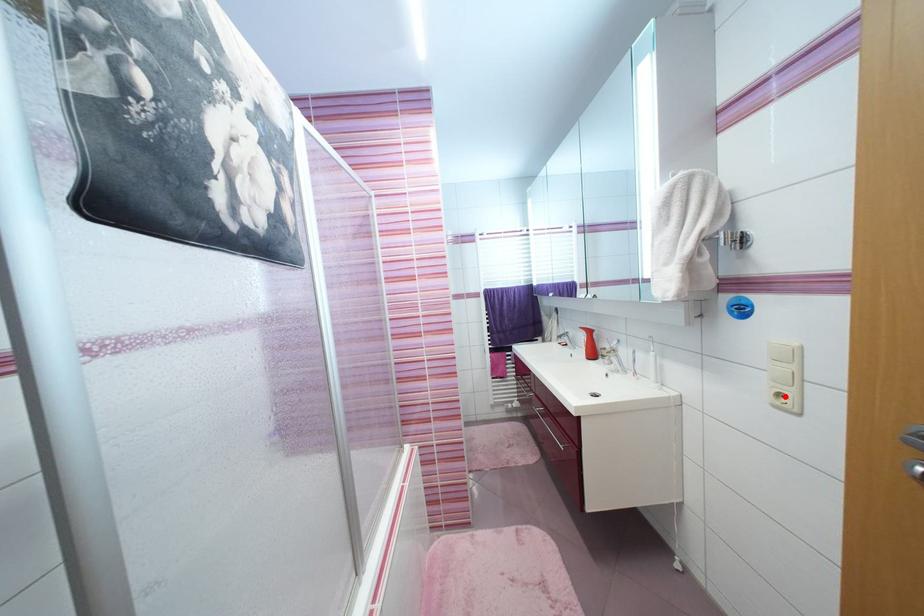
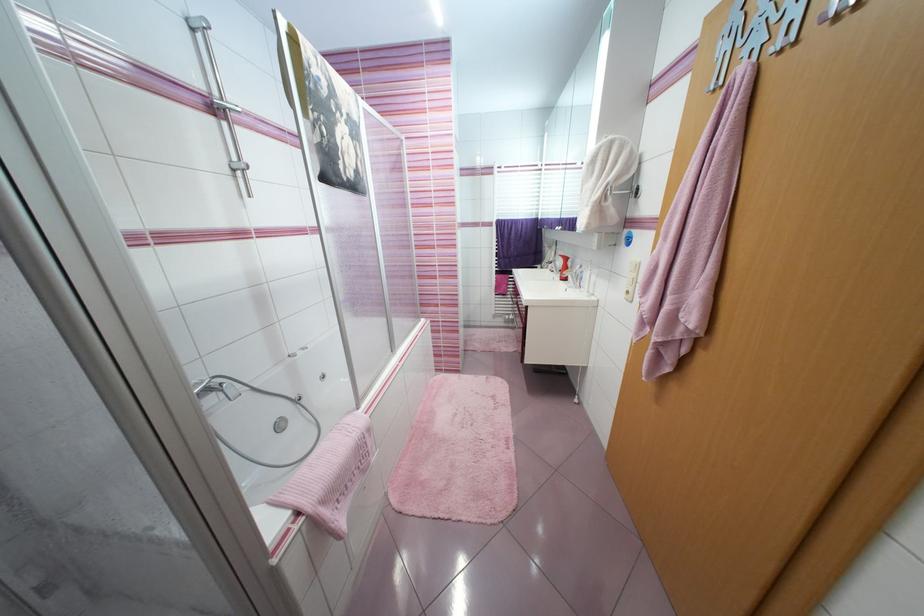
Locate, in the second image, the point that corresponds to the highlighted location in the first image.

(633, 293)